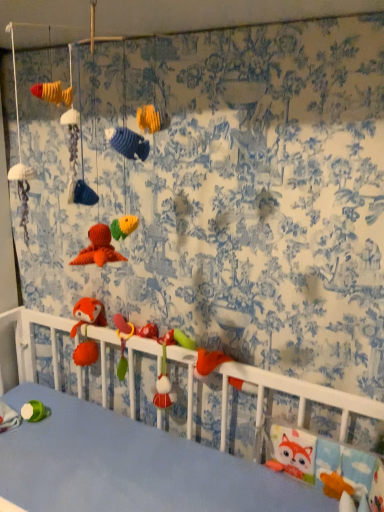
Question: From the image's perspective, is rubber duck at center, the 1th toy when ordered from top to bottom, below white plush toy at lower left, the 1th toy positioned from the bottom?

Choices:
 (A) yes
 (B) no

Answer: (B)

Question: Is rubber duck at center, arranged as the second toy when viewed from the left, far away from white plush toy at lower left, placed as the 2th toy when sorted from top to bottom?

Choices:
 (A) no
 (B) yes

Answer: (A)

Question: Does rubber duck at center, the 1th toy when ordered from top to bottom, have a greater height compared to white plush toy at lower left, placed as the 2th toy when sorted from top to bottom?

Choices:
 (A) no
 (B) yes

Answer: (B)

Question: Considering the relative sizes of rubber duck at center, arranged as the second toy when viewed from the left, and white plush toy at lower left, placed as the 2th toy when sorted from top to bottom, in the image provided, is rubber duck at center, arranged as the second toy when viewed from the left, thinner than white plush toy at lower left, placed as the 2th toy when sorted from top to bottom,?

Choices:
 (A) yes
 (B) no

Answer: (A)

Question: Considering the relative sizes of rubber duck at center, the 1th toy when ordered from top to bottom, and white plush toy at lower left, the 1th toy positioned from the bottom, in the image provided, is rubber duck at center, the 1th toy when ordered from top to bottom, wider than white plush toy at lower left, the 1th toy positioned from the bottom,?

Choices:
 (A) yes
 (B) no

Answer: (B)

Question: Is rubber duck at center, the 1th toy when ordered from top to bottom, closer to camera compared to white plush toy at lower left, which is the second toy in right-to-left order?

Choices:
 (A) no
 (B) yes

Answer: (A)

Question: Is white plush toy at lower left, placed as the 2th toy when sorted from top to bottom, taller than rubber duck at center, the 1th toy from the right?

Choices:
 (A) yes
 (B) no

Answer: (B)

Question: Considering the relative sizes of white plush toy at lower left, which is the second toy in right-to-left order, and rubber duck at center, the 1th toy from the right, in the image provided, is white plush toy at lower left, which is the second toy in right-to-left order, shorter than rubber duck at center, the 1th toy from the right,?

Choices:
 (A) no
 (B) yes

Answer: (B)

Question: From the image's perspective, would you say white plush toy at lower left, the 1th toy positioned from the bottom, is positioned over rubber duck at center, placed as the second toy when sorted from bottom to top?

Choices:
 (A) no
 (B) yes

Answer: (A)

Question: Considering the relative sizes of white plush toy at lower left, the 1th toy in the left-to-right sequence, and rubber duck at center, arranged as the second toy when viewed from the left, in the image provided, is white plush toy at lower left, the 1th toy in the left-to-right sequence, smaller than rubber duck at center, arranged as the second toy when viewed from the left,?

Choices:
 (A) yes
 (B) no

Answer: (B)

Question: Does white plush toy at lower left, the 1th toy in the left-to-right sequence, have a lesser width compared to rubber duck at center, the 1th toy from the right?

Choices:
 (A) yes
 (B) no

Answer: (B)

Question: Considering the relative sizes of white plush toy at lower left, which is the second toy in right-to-left order, and rubber duck at center, the 1th toy from the right, in the image provided, is white plush toy at lower left, which is the second toy in right-to-left order, wider than rubber duck at center, the 1th toy from the right,?

Choices:
 (A) yes
 (B) no

Answer: (A)

Question: Is rubber duck at center, placed as the second toy when sorted from bottom to top, spatially inside white plush toy at lower left, the 1th toy positioned from the bottom, or outside of it?

Choices:
 (A) inside
 (B) outside

Answer: (B)